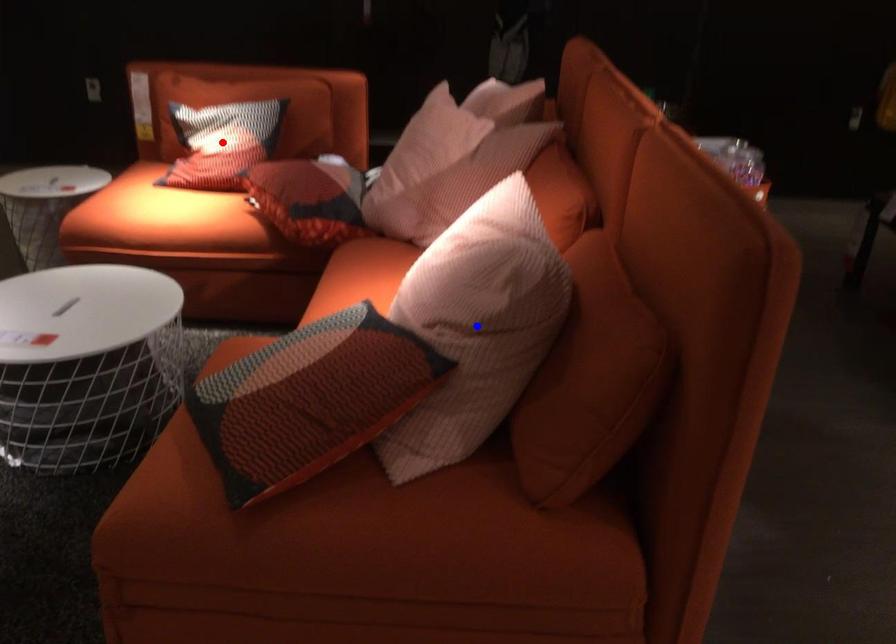
Question: Which of the two points in the image is closer to the camera?

Choices:
 (A) Blue point is closer.
 (B) Red point is closer.

Answer: (A)